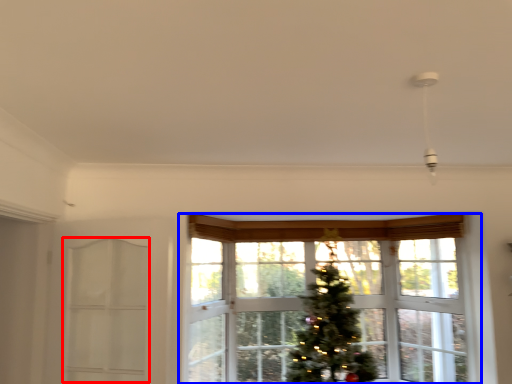
Question: Among these objects, which one is farthest to the camera, screen door (highlighted by a red box) or window (highlighted by a blue box)?

Choices:
 (A) screen door
 (B) window

Answer: (B)